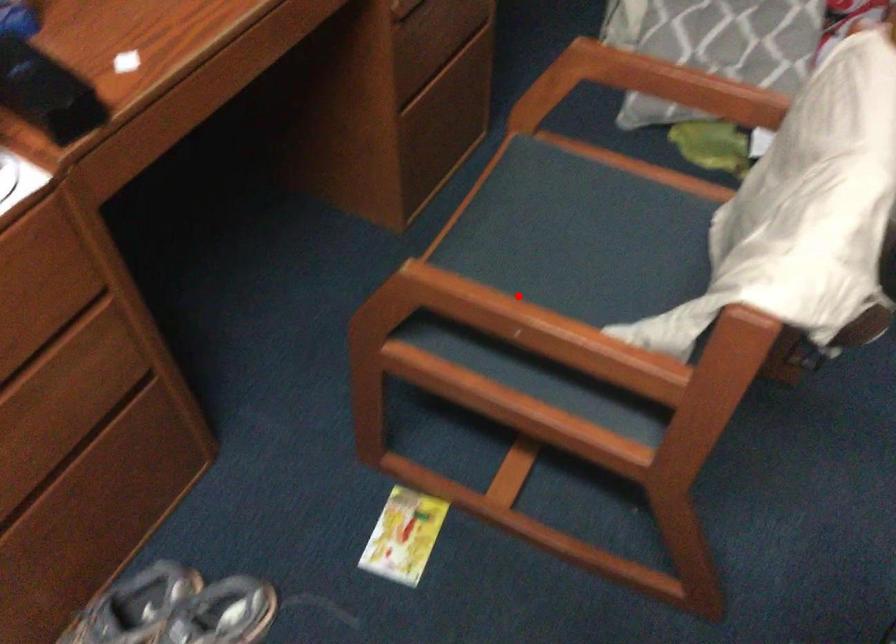
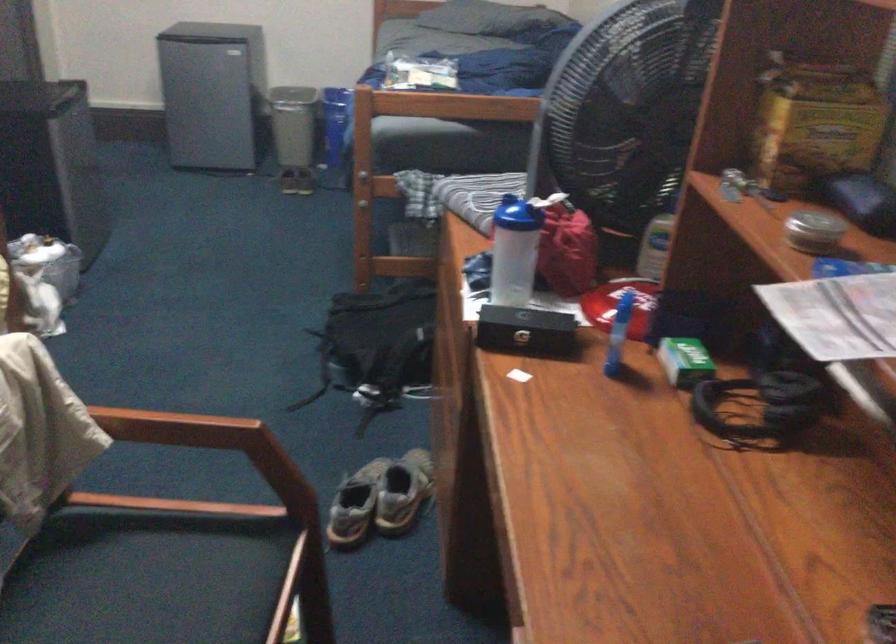
Find the pixel in the second image that matches the highlighted location in the first image.

(176, 428)